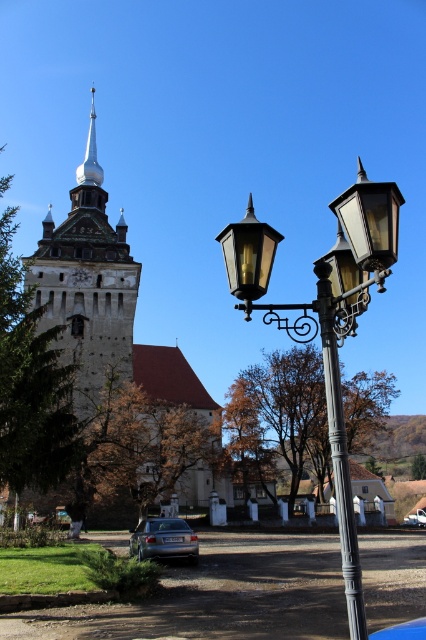
You are standing in front of the historic building and want to take a photo that includes both the spire and the streetlamp. The spire is at point (x=85, y=410) and the streetlamp is at point (x=92, y=150). Which point should you focus on to ensure both are in sharp focus?

You should focus on point (x=92, y=150) because it is farther from the camera than point (x=85, y=410). By focusing on the farther point, both the spire and the streetlamp will be in sharp focus.

You are a delivery drone carrying a package that requires a minimum of 100 feet of clearance between obstacles to ensure safe flight. You need to fly from the dark brown stone church at upper left to the matte black street light at center. Can you safely navigate this path without coming too close to either obstacle?

The dark brown stone church at upper left and matte black street light at center are 139.55 feet apart from each other. Since the required minimum clearance is 100 feet, the distance between them allows for safe navigation as 139.55 feet exceeds the 100 feet requirement. Therefore, the drone can safely fly between the two obstacles.

You are an architect analyzing the historic building in the image. You notice two spires, the wooden spire at upper left and the white glossy spire at upper center. Which spire has a greater height?

The wooden spire at upper left is larger in size than the white glossy spire at upper center, so it has a greater height.